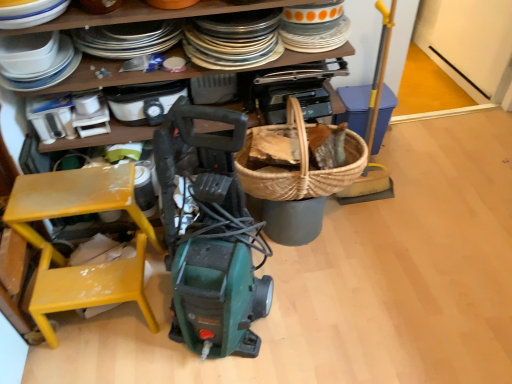
You are a GUI agent. You are given a task and a screenshot of the screen. Output one action in this format:
    pyautogui.click(x=<x>, y=<y>)
    Task: Click on the yellow painted wood chair at lower left
    The image size is (512, 384).
    Given the screenshot: What is the action you would take?
    click(63, 256)

The height and width of the screenshot is (384, 512). Describe the element at coordinates (63, 256) in the screenshot. I see `yellow painted wood chair at lower left` at that location.

In order to face white plastic coffee maker at upper left, which ranks as the 2th appliance in left-to-right order, should I rotate leftwards or rightwards?

To align with it, rotate left about 25.135°.

How much space does white plastic container at upper left, placed as the third appliance when sorted from right to left, occupy vertically?

white plastic container at upper left, placed as the third appliance when sorted from right to left, is 14.79 centimeters in height.

You are a GUI agent. You are given a task and a screenshot of the screen. Output one action in this format:
    pyautogui.click(x=<x>, y=<y>)
    Task: Click on the woven basket at right, which is the first appliance in right-to-left order
    
    Given the screenshot: What is the action you would take?
    pyautogui.click(x=354, y=107)

You are a GUI agent. You are given a task and a screenshot of the screen. Output one action in this format:
    pyautogui.click(x=<x>, y=<y>)
    Task: Click on the yellow painted wood chair at lower left
    
    Given the screenshot: What is the action you would take?
    pyautogui.click(x=63, y=256)

How distant is woven basket at right, which is the first appliance in right-to-left order, from white plastic toaster at upper center, acting as the 2th appliance starting from the right?

The distance of woven basket at right, which is the first appliance in right-to-left order, from white plastic toaster at upper center, acting as the 2th appliance starting from the right, is 32.50 inches.

From a real-world perspective, does woven basket at right, which is the first appliance in right-to-left order, stand above white plastic toaster at upper center, the fourth appliance positioned from the left?

No, from a real-world perspective, woven basket at right, which is the first appliance in right-to-left order, is not on top of white plastic toaster at upper center, the fourth appliance positioned from the left.

Is white plastic toaster at upper center, the fourth appliance positioned from the left, completely or partially inside woven basket at right, which is the first appliance in right-to-left order?

No.

Is white plastic container at upper left, placed as the third appliance when sorted from right to left, oriented towards woven wood basket at center?

No, white plastic container at upper left, placed as the third appliance when sorted from right to left, is not turned towards woven wood basket at center.

Can we say white plastic container at upper left, acting as the 3th appliance starting from the left, lies outside woven wood basket at center?

Yes, white plastic container at upper left, acting as the 3th appliance starting from the left, is located beyond the bounds of woven wood basket at center.

Are white plastic container at upper left, acting as the 3th appliance starting from the left, and woven wood basket at center making contact?

No.

From the image's perspective, is white plastic container at upper left, placed as the third appliance when sorted from right to left, located above woven wood basket at center?

Yes, from the image's perspective, white plastic container at upper left, placed as the third appliance when sorted from right to left, is above woven wood basket at center.

Which of these two, woven basket at right, which ranks as the fifth appliance in left-to-right order, or woven wood basket at center, is wider?

With larger width is woven basket at right, which ranks as the fifth appliance in left-to-right order.

How many degrees apart are the facing directions of woven basket at right, which ranks as the fifth appliance in left-to-right order, and woven wood basket at center?

0.000459 degrees.

Locate an element on the screen. the 4th appliance behind when counting from the woven wood basket at center is located at coordinates tap(354, 107).

Is point (381, 132) more distant than point (241, 178)?

Yes, point (381, 132) is behind point (241, 178).

Does point (350, 144) lie in front of point (234, 137)?

That is True.

Is woven wood basket at center next to green plastic vacuum cleaner at center?

No, woven wood basket at center is not making contact with green plastic vacuum cleaner at center.

Can you confirm if green plastic vacuum cleaner at center is taller than white plastic container at upper left, acting as the 3th appliance starting from the left?

In fact, green plastic vacuum cleaner at center may be shorter than white plastic container at upper left, acting as the 3th appliance starting from the left.

Is green plastic vacuum cleaner at center situated inside white plastic container at upper left, acting as the 3th appliance starting from the left, or outside?

green plastic vacuum cleaner at center is spatially situated outside white plastic container at upper left, acting as the 3th appliance starting from the left.

Which is in front, green plastic vacuum cleaner at center or white plastic container at upper left, acting as the 3th appliance starting from the left?

green plastic vacuum cleaner at center is closer to the camera.

Is green plastic vacuum cleaner at center positioned far away from white plastic container at upper left, placed as the third appliance when sorted from right to left?

No, green plastic vacuum cleaner at center is not far from white plastic container at upper left, placed as the third appliance when sorted from right to left.

Is white plastic container at upper left, placed as the third appliance when sorted from right to left, next to white glossy plates at upper left and touching it?

→ No, white plastic container at upper left, placed as the third appliance when sorted from right to left, is not next to white glossy plates at upper left.

Find the location of a particular element. This screenshot has height=384, width=512. appliance that is the 2nd one when counting leftward from the white glossy plates at upper left is located at coordinates click(90, 114).

From a real-world perspective, is white plastic container at upper left, acting as the 3th appliance starting from the left, positioned over white glossy plates at upper left based on gravity?

No, from a real-world perspective, white plastic container at upper left, acting as the 3th appliance starting from the left, is not over white glossy plates at upper left

Considering the sizes of objects woven wood basket at center and white glossy plate at upper left, the 5th appliance from the right, in the image provided, who is bigger, woven wood basket at center or white glossy plate at upper left, the 5th appliance from the right,?

woven wood basket at center is bigger.

Consider the image. Is woven wood basket at center situated inside white glossy plate at upper left, marked as the first appliance in a left-to-right arrangement, or outside?

woven wood basket at center cannot be found inside white glossy plate at upper left, marked as the first appliance in a left-to-right arrangement.

Based on the photo, which of these two, woven wood basket at center or white glossy plate at upper left, marked as the first appliance in a left-to-right arrangement, stands shorter?

Standing shorter between the two is white glossy plate at upper left, marked as the first appliance in a left-to-right arrangement.

From a real-world perspective, is woven wood basket at center positioned above or below white glossy plate at upper left, the 5th appliance from the right?

In terms of real-world spatial position, woven wood basket at center is below white glossy plate at upper left, the 5th appliance from the right.

Where is `appliance that appears behind the white plastic toaster at upper center, acting as the 2th appliance starting from the right`? The width and height of the screenshot is (512, 384). appliance that appears behind the white plastic toaster at upper center, acting as the 2th appliance starting from the right is located at coordinates (354, 107).

Find the location of a particular element. The height and width of the screenshot is (384, 512). basket below the white plastic container at upper left, placed as the third appliance when sorted from right to left (from the image's perspective) is located at coordinates (300, 166).

From the image, which object appears to be farther from woven wood basket at center, yellow painted wood chair at lower left or white plastic coffee maker at upper left, the 4th appliance from the right?

white plastic coffee maker at upper left, the 4th appliance from the right, lies further to woven wood basket at center than the other object.

When comparing their distances from yellow painted wood chair at lower left, does green plastic vacuum cleaner at center or woven wood basket at center seem further?

woven wood basket at center is positioned further to the anchor yellow painted wood chair at lower left.

Considering their positions, is white plastic container at upper left, acting as the 3th appliance starting from the left, positioned closer to woven wood basket at center than yellow painted wood chair at lower left?

yellow painted wood chair at lower left.

Estimate the real-world distances between objects in this image. Which object is closer to green plastic vacuum cleaner at center, yellow painted wood chair at lower left or white plastic container at upper left, placed as the third appliance when sorted from right to left?

yellow painted wood chair at lower left lies closer to green plastic vacuum cleaner at center than the other object.

Based on the photo, when comparing their distances from woven basket at right, which ranks as the fifth appliance in left-to-right order, does white plastic coffee maker at upper left, which ranks as the 2th appliance in left-to-right order, or white plastic toaster at upper center, the fourth appliance positioned from the left, seem further?

white plastic coffee maker at upper left, which ranks as the 2th appliance in left-to-right order, is further to woven basket at right, which ranks as the fifth appliance in left-to-right order.

In the scene shown: From the image, which object appears to be farther from white plastic container at upper left, placed as the third appliance when sorted from right to left, white plastic toaster at upper center, the fourth appliance positioned from the left, or white glossy plates at upper left?

Among the two, white glossy plates at upper left is located further to white plastic container at upper left, placed as the third appliance when sorted from right to left.

Estimate the real-world distances between objects in this image. Which object is closer to white plastic toaster at upper center, the fourth appliance positioned from the left, white plastic coffee maker at upper left, the 4th appliance from the right, or yellow painted wood chair at lower left?

white plastic coffee maker at upper left, the 4th appliance from the right, is positioned closer to the anchor white plastic toaster at upper center, the fourth appliance positioned from the left.

Estimate the real-world distances between objects in this image. Which object is further from white glossy plates at upper left, green plastic vacuum cleaner at center or white glossy plate at upper left, the 5th appliance from the right?

green plastic vacuum cleaner at center.

Locate an element on the screen. The height and width of the screenshot is (384, 512). chair located between white glossy plate at upper left, marked as the first appliance in a left-to-right arrangement, and woven basket at right, which ranks as the fifth appliance in left-to-right order, in the left-right direction is located at coordinates (63, 256).

In order to click on shelf situated between white plastic container at upper left, acting as the 3th appliance starting from the left, and woven wood basket at center from left to right in this screenshot , I will do tap(152, 13).

You are a GUI agent. You are given a task and a screenshot of the screen. Output one action in this format:
    pyautogui.click(x=<x>, y=<y>)
    Task: Click on the appliance between white plastic container at upper left, acting as the 3th appliance starting from the left, and green plastic vacuum cleaner at center, in the horizontal direction
    The width and height of the screenshot is (512, 384).
    Given the screenshot: What is the action you would take?
    pyautogui.click(x=144, y=102)

Image resolution: width=512 pixels, height=384 pixels. Identify the location of collection between yellow painted wood chair at lower left and woven basket at right, which is the first appliance in right-to-left order, from left to right. (64, 257).